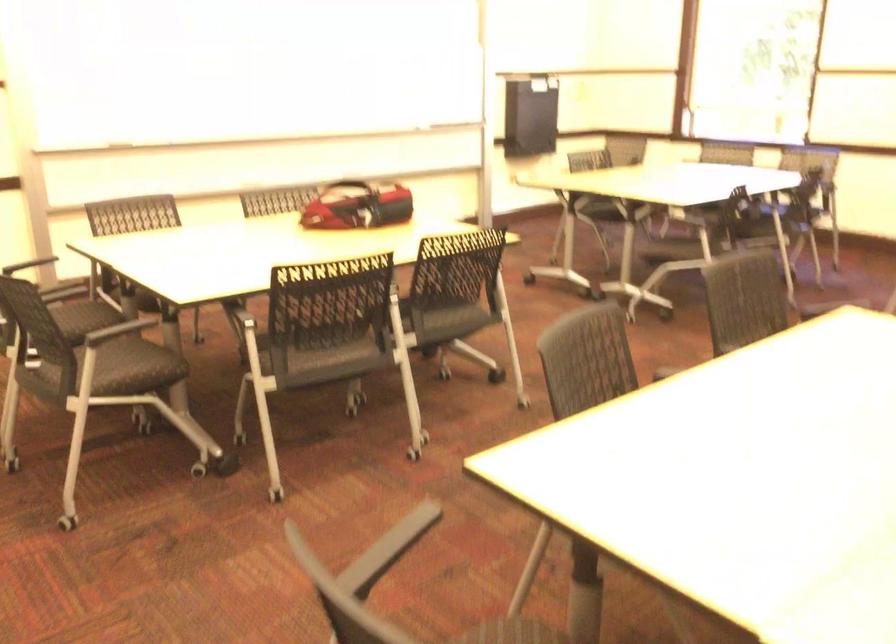
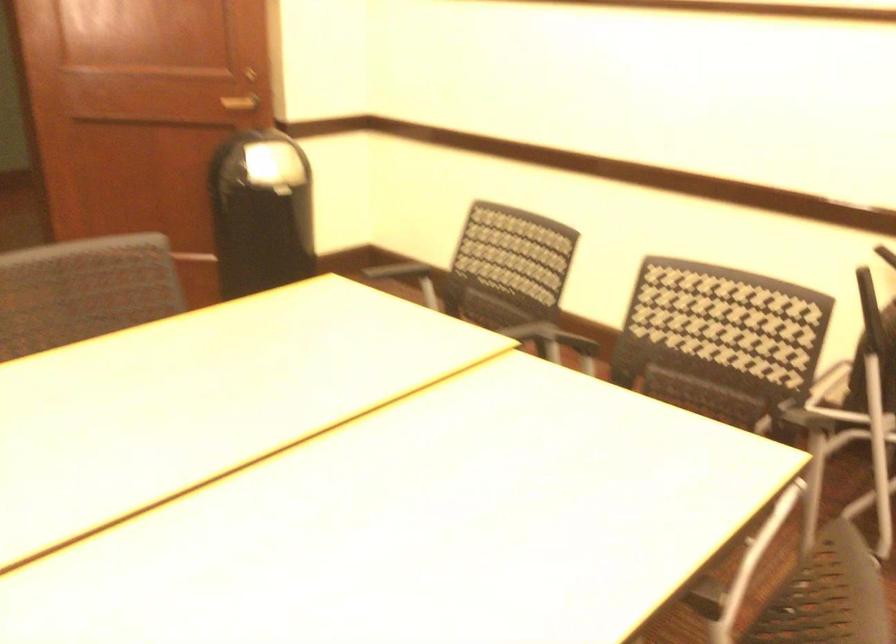
Question: I am providing you with two images of the same scene from different viewpoints. Which of the following objects are not visible in image2?

Choices:
 (A) tan file folder
 (B) gray chair sitting surface
 (C) brown door handle
 (D) trash can lid

Answer: (B)